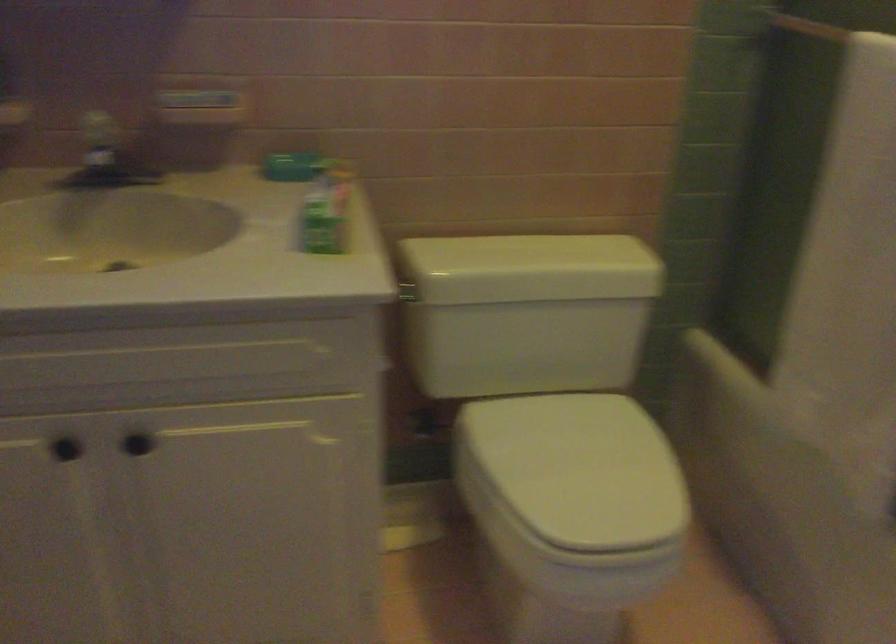
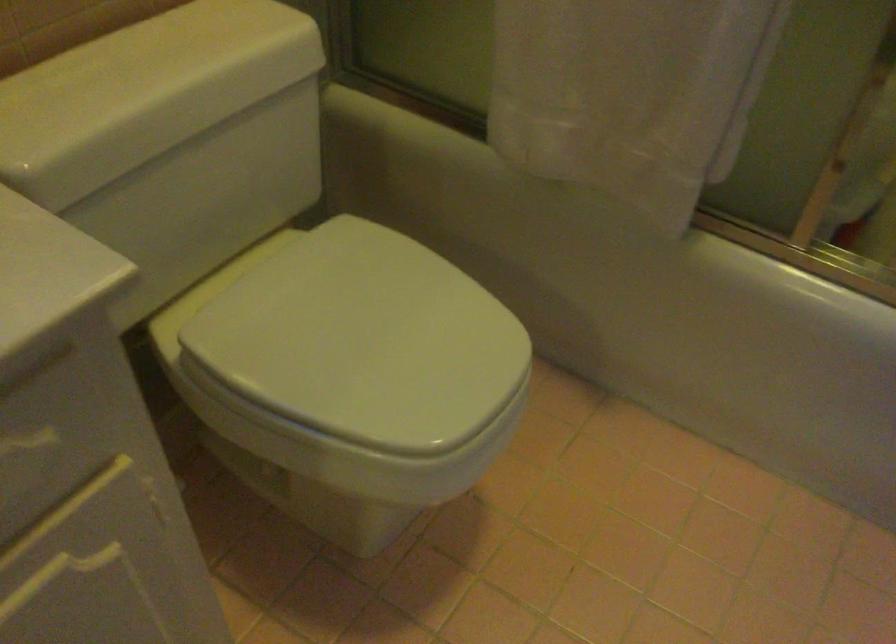
The first image is from the beginning of the video and the second image is from the end. How did the camera likely rotate when shooting the video?

The rotation direction of the camera is right-down.